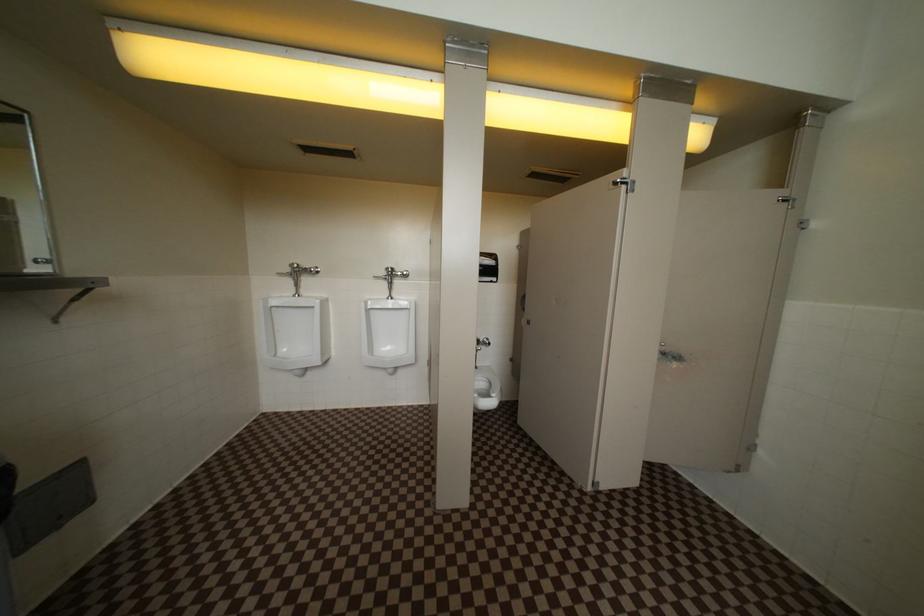
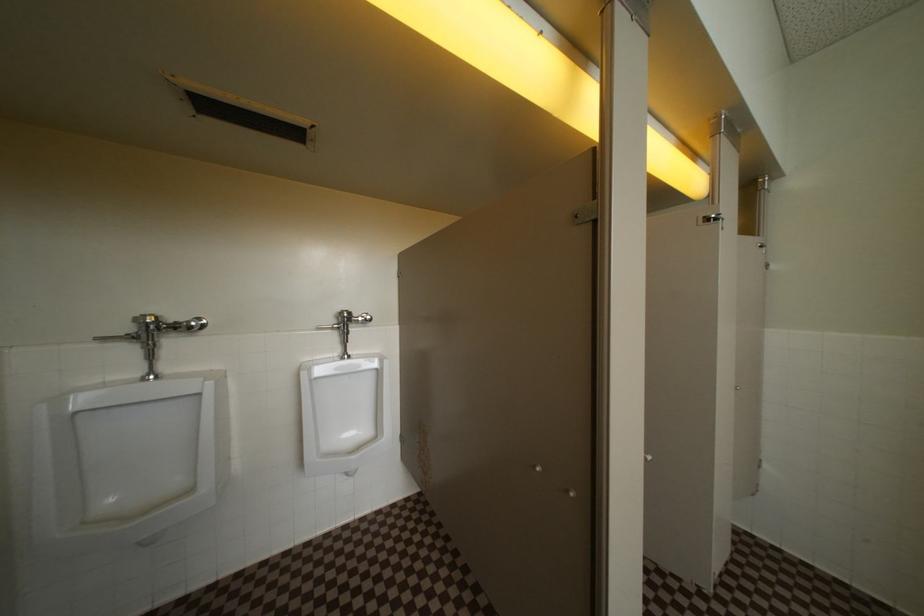
Question: The first image is from the beginning of the video and the second image is from the end. How did the camera likely rotate when shooting the video?

Choices:
 (A) Left
 (B) Right
 (C) Up
 (D) Down

Answer: (B)